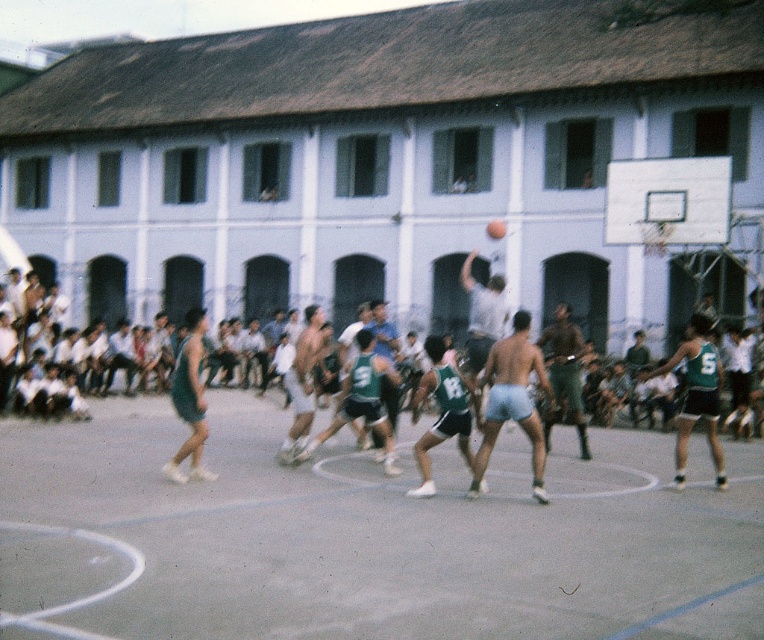
Question: Is light blue shorts at center positioned at the back of dark green shorts at center?

Choices:
 (A) yes
 (B) no

Answer: (B)

Question: Does concrete basketball court at center appear over green jersey shorts at center?

Choices:
 (A) yes
 (B) no

Answer: (B)

Question: Which object is the farthest from the matte gray shorts at center?

Choices:
 (A) green uniform at center
 (B) concrete basketball court at center
 (C) light blue shorts at center

Answer: (A)

Question: Which point is closer to the camera?

Choices:
 (A) dark green shorts at center
 (B) green uniform at center
 (C) concrete basketball court at center

Answer: (C)

Question: Is green uniform at center further to camera compared to matte gray shorts at center?

Choices:
 (A) yes
 (B) no

Answer: (A)

Question: Based on their relative distances, which object is farther from the matte gray shorts at center?

Choices:
 (A) light blue shorts at center
 (B) green jersey shorts at center
 (C) rubber textured basketball at center

Answer: (C)